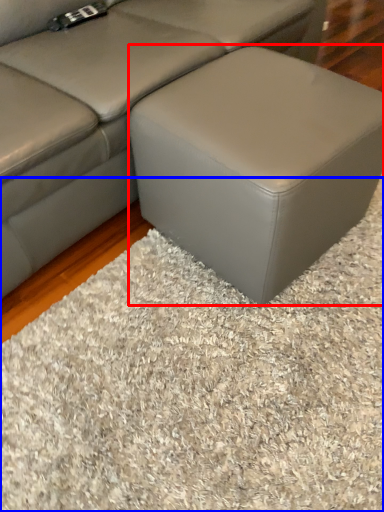
Question: Which object appears closest to the camera in this image, stool (highlighted by a red box) or mat (highlighted by a blue box)?

Choices:
 (A) stool
 (B) mat

Answer: (B)